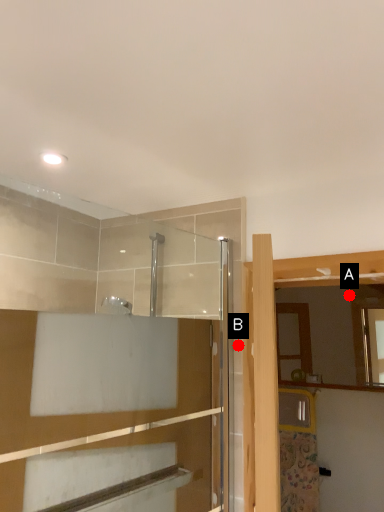
Question: Two points are circled on the image, labeled by A and B beside each circle. Which point is closer to the camera?

Choices:
 (A) A is closer
 (B) B is closer

Answer: (B)